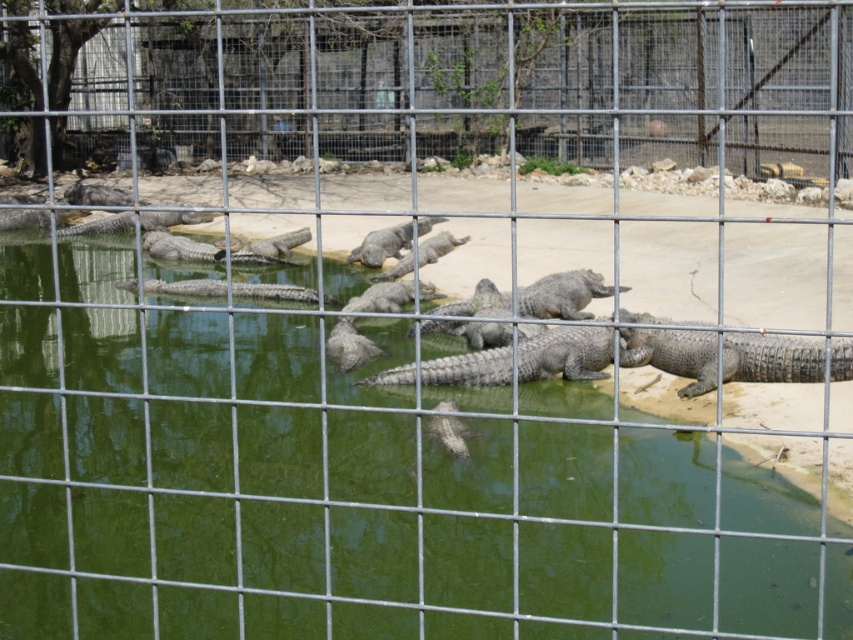
Consider the image. Is metal wire fence at center to the right of gray scaly crocodile at center from the viewer's perspective?

Yes, metal wire fence at center is to the right of gray scaly crocodile at center.

Between metal wire fence at center and gray scaly crocodile at center, which one has more height?

metal wire fence at center

Measure the distance between metal wire fence at center and camera.

metal wire fence at center and camera are 3.13 meters apart.

Locate an element on the screen. metal wire fence at center is located at coordinates (444, 81).

Can you confirm if green murky water at center is smaller than metal wire fence at center?

Yes, green murky water at center is smaller than metal wire fence at center.

Describe the element at coordinates (351, 486) in the screenshot. I see `green murky water at center` at that location.

Locate an element on the screen. green murky water at center is located at coordinates (351, 486).

Is the position of gray textured crocodile at right more distant than that of gray scaly crocodile at center?

No, gray textured crocodile at right is closer to the viewer.

Between gray textured crocodile at right and gray scaly crocodile at center, which one has less height?

gray scaly crocodile at center is shorter.

What do you see at coordinates (770, 356) in the screenshot? This screenshot has width=853, height=640. I see `gray textured crocodile at right` at bounding box center [770, 356].

This screenshot has width=853, height=640. In order to click on gray textured crocodile at right in this screenshot , I will do 770,356.